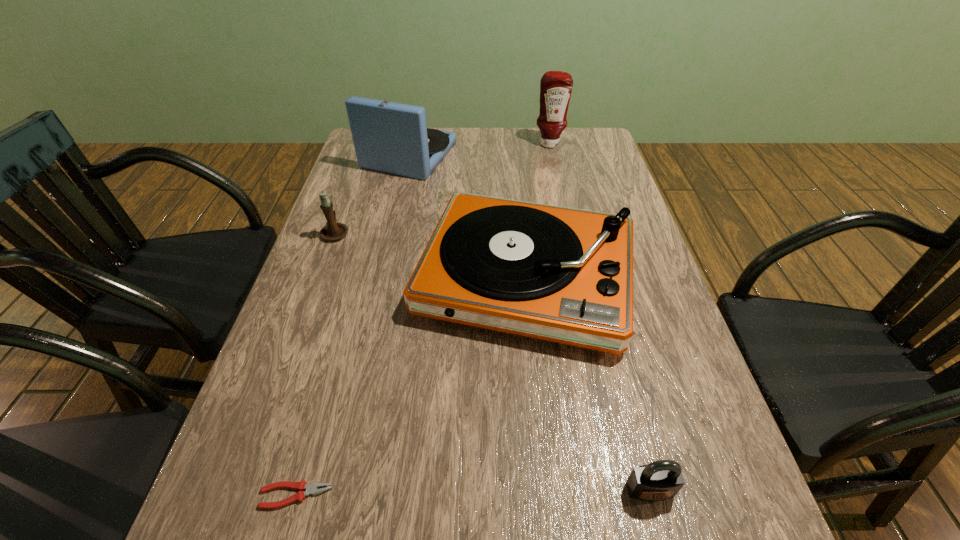
In order to click on free region located 0.310m on the side of the candle holder with the handle in this screenshot , I will do `click(361, 162)`.

What are the coordinates of `vacant space situated on the back of the record player` in the screenshot? It's located at coord(516,188).

Locate an element on the screen. The height and width of the screenshot is (540, 960). free region located 0.060m on the back of the pliers is located at coordinates (309, 446).

You are a GUI agent. You are given a task and a screenshot of the screen. Output one action in this format:
    pyautogui.click(x=<x>, y=<y>)
    Task: Click on the condiment that is at the far edge
    The height and width of the screenshot is (540, 960).
    Given the screenshot: What is the action you would take?
    pyautogui.click(x=556, y=86)

Identify the location of phonograph record present at the far edge. This screenshot has width=960, height=540. (389, 137).

The image size is (960, 540). I want to click on phonograph record that is at the left edge, so click(x=389, y=137).

I want to click on candle holder positioned at the left edge, so click(332, 231).

The width and height of the screenshot is (960, 540). Find the location of `pliers present at the left edge`. pliers present at the left edge is located at coordinates (310, 489).

Locate an element on the screen. The height and width of the screenshot is (540, 960). condiment present at the right edge is located at coordinates (556, 86).

Locate an element on the screen. Image resolution: width=960 pixels, height=540 pixels. record player that is at the right edge is located at coordinates (565, 275).